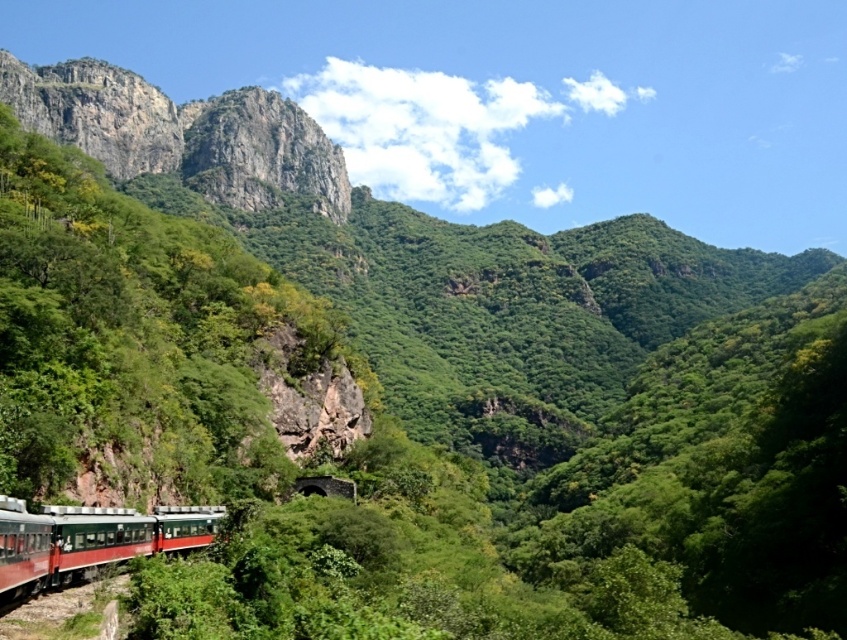
Question: Can you confirm if rugged stone mountain at upper left is bigger than metallic green train at lower left?

Choices:
 (A) yes
 (B) no

Answer: (A)

Question: Which point is farther to the camera?

Choices:
 (A) rugged stone mountain at upper left
 (B) metallic green train at lower left

Answer: (A)

Question: Can you confirm if rugged stone mountain at upper left is smaller than metallic green train at lower left?

Choices:
 (A) no
 (B) yes

Answer: (A)

Question: Which of the following is the farthest from the observer?

Choices:
 (A) metallic green train at lower left
 (B) rugged stone mountain at upper left

Answer: (B)

Question: Can you confirm if rugged stone mountain at upper left is positioned to the left of metallic green train at lower left?

Choices:
 (A) no
 (B) yes

Answer: (B)

Question: Which point is farther to the camera?

Choices:
 (A) rugged stone mountain at upper left
 (B) metallic green train at lower left

Answer: (A)